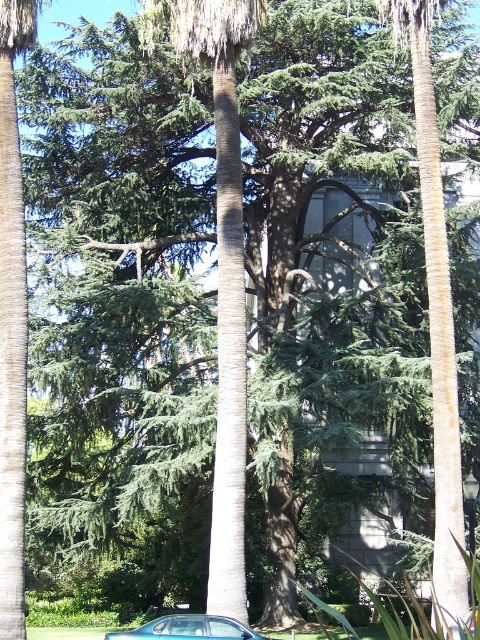
Question: Is brown textured palm tree at center closer to camera compared to metallic silver car at lower center?

Choices:
 (A) yes
 (B) no

Answer: (A)

Question: Observing the image, what is the correct spatial positioning of smooth brown palm tree at center in reference to metallic silver car at lower center?

Choices:
 (A) below
 (B) above

Answer: (B)

Question: Can you confirm if brown textured palm tree at center is positioned below metallic silver car at lower center?

Choices:
 (A) yes
 (B) no

Answer: (B)

Question: Which of the following is the closest to the observer?

Choices:
 (A) (152, 627)
 (B) (226, 152)
 (C) (450, 298)

Answer: (A)

Question: Which of the following is the farthest from the observer?

Choices:
 (A) (423, 147)
 (B) (223, 529)

Answer: (A)

Question: Which object is positioned closest to the metallic silver car at lower center?

Choices:
 (A) brown textured palm tree at center
 (B) smooth brown palm tree at center

Answer: (A)